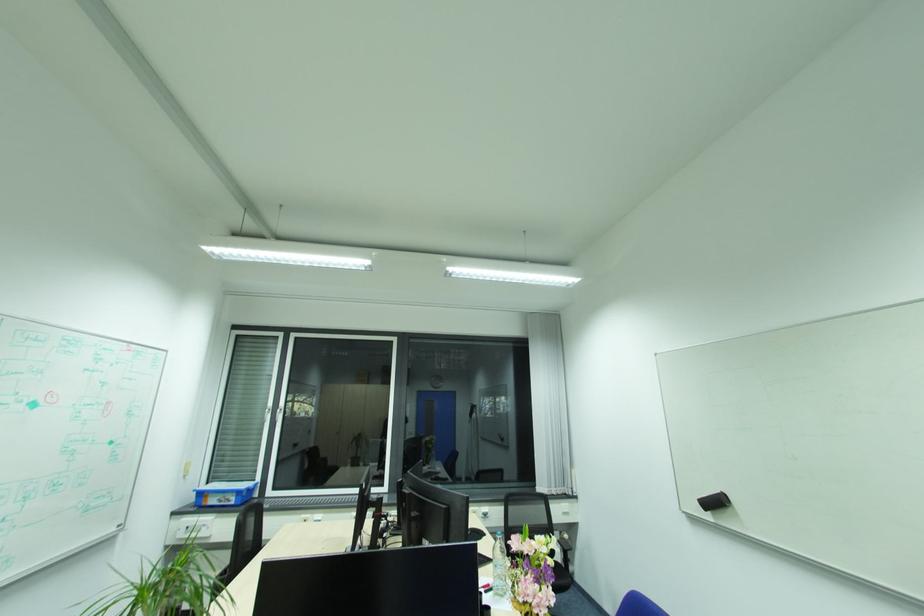
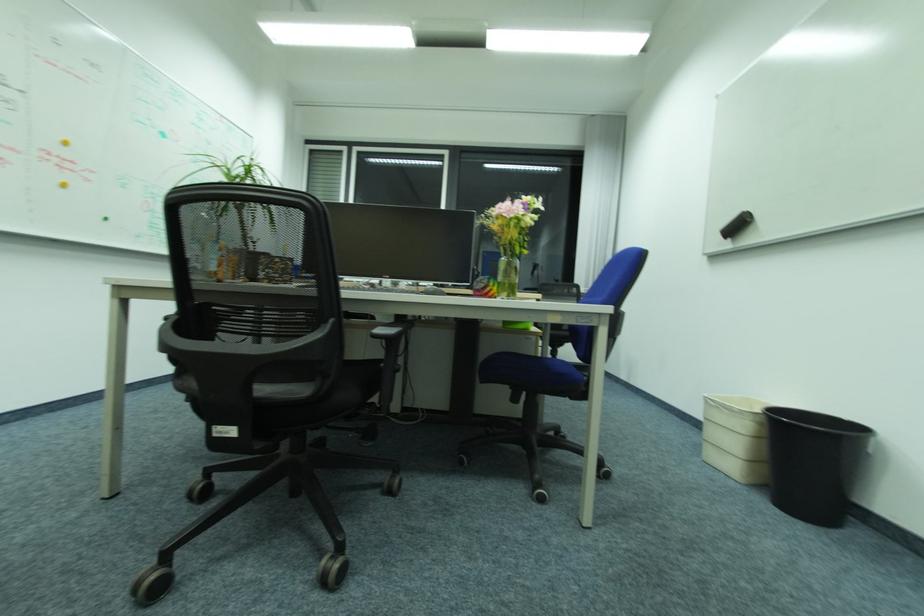
The images are taken continuously from a first-person perspective. In which direction are you moving?

The movement direction of the cameraman is right, backward.